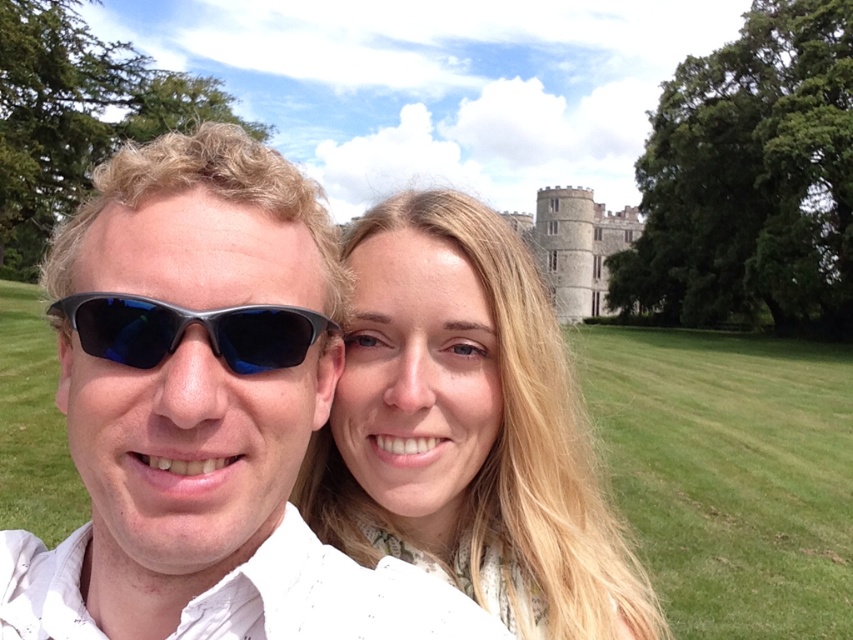
Question: Can you confirm if matte white sunglasses at center is positioned to the right of sunglasses at left?

Choices:
 (A) no
 (B) yes

Answer: (A)

Question: Which of the following is the closest to the observer?

Choices:
 (A) (252, 317)
 (B) (223, 520)
 (C) (480, 476)

Answer: (B)

Question: Can you confirm if blonde hair at center is thinner than sunglasses at left?

Choices:
 (A) yes
 (B) no

Answer: (B)

Question: Observing the image, what is the correct spatial positioning of sunglasses at left in reference to stone medieval tower at center?

Choices:
 (A) above
 (B) below

Answer: (B)

Question: Which point appears closest to the camera in this image?

Choices:
 (A) (479, 570)
 (B) (296, 321)
 (C) (576, 204)

Answer: (B)

Question: Which point appears farthest from the camera in this image?

Choices:
 (A) (357, 444)
 (B) (297, 314)

Answer: (A)